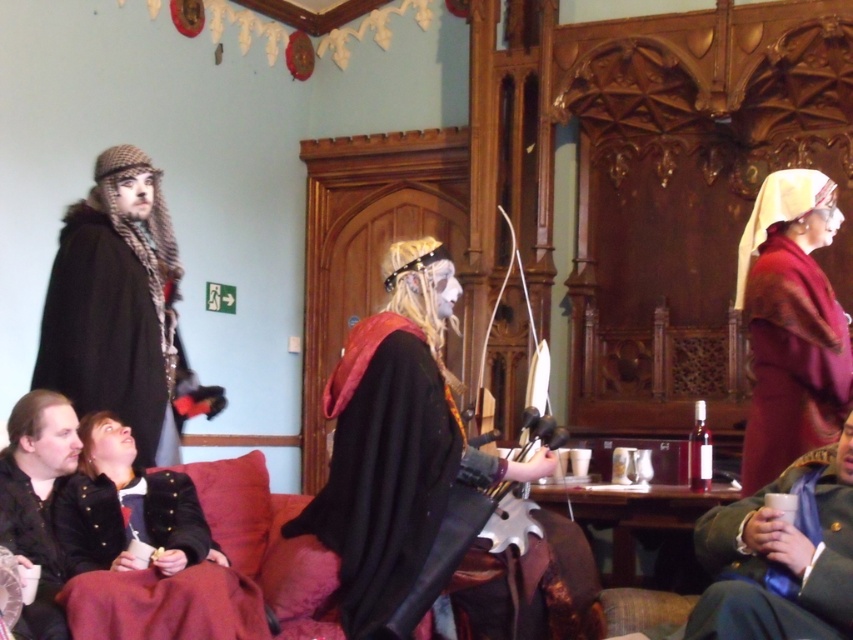
Is green fabric jacket at lower right above dark brown woolen robe at left?

No.

Does green fabric jacket at lower right have a lesser width compared to dark brown woolen robe at left?

No, green fabric jacket at lower right is not thinner than dark brown woolen robe at left.

Is point (775, 580) positioned in front of point (144, 291)?

Yes, it is.

I want to click on green fabric jacket at lower right, so click(x=781, y=557).

Is velvet black coat at lower left positioned in front of black leather jacket at lower left?

No, velvet black coat at lower left is further to the viewer.

Can you confirm if velvet black coat at lower left is thinner than black leather jacket at lower left?

No.

Is point (97, 627) farther from viewer compared to point (56, 406)?

No.

Identify the location of velvet black coat at lower left. This screenshot has height=640, width=853. (151, 556).

Which is below, velvet maroon dress at upper right or black leather jacket at lower left?

black leather jacket at lower left is lower down.

Is velvet maroon dress at upper right in front of black leather jacket at lower left?

No, it is behind black leather jacket at lower left.

Which is in front, point (822, 428) or point (25, 556)?

Positioned in front is point (25, 556).

Where is `velvet maroon dress at upper right`? This screenshot has width=853, height=640. velvet maroon dress at upper right is located at coordinates (790, 324).